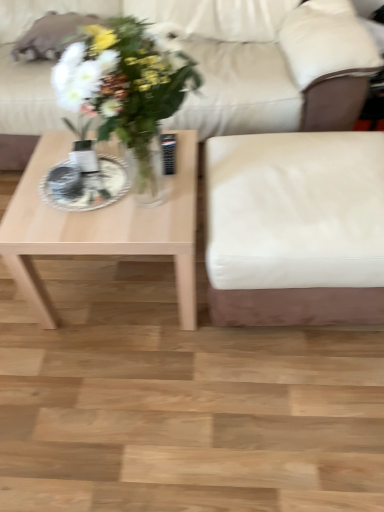
Question: Does light wood coffee table at left have a larger size compared to beige leather couch at center?

Choices:
 (A) yes
 (B) no

Answer: (B)

Question: From a real-world perspective, is light wood coffee table at left positioned under beige leather couch at center based on gravity?

Choices:
 (A) yes
 (B) no

Answer: (A)

Question: Does light wood coffee table at left have a lesser width compared to beige leather couch at center?

Choices:
 (A) no
 (B) yes

Answer: (B)

Question: From the image's perspective, does light wood coffee table at left appear higher than beige leather couch at center?

Choices:
 (A) yes
 (B) no

Answer: (B)

Question: Does light wood coffee table at left appear on the right side of beige leather couch at center?

Choices:
 (A) yes
 (B) no

Answer: (B)

Question: Can you confirm if light wood coffee table at left is shorter than beige leather couch at center?

Choices:
 (A) yes
 (B) no

Answer: (A)

Question: Is beige leather couch at center at the back of white glossy plate at center?

Choices:
 (A) yes
 (B) no

Answer: (A)

Question: Is white glossy plate at center to the left of beige leather couch at center from the viewer's perspective?

Choices:
 (A) no
 (B) yes

Answer: (B)

Question: Does white glossy plate at center appear on the right side of beige leather couch at center?

Choices:
 (A) yes
 (B) no

Answer: (B)

Question: From the image's perspective, does white glossy plate at center appear higher than beige leather couch at center?

Choices:
 (A) no
 (B) yes

Answer: (A)

Question: Does white glossy plate at center have a lesser width compared to beige leather couch at center?

Choices:
 (A) yes
 (B) no

Answer: (A)

Question: Does white glossy plate at center have a greater width compared to beige leather couch at center?

Choices:
 (A) yes
 (B) no

Answer: (B)

Question: Is light wood coffee table at left taller than white leather armchair at right?

Choices:
 (A) no
 (B) yes

Answer: (A)